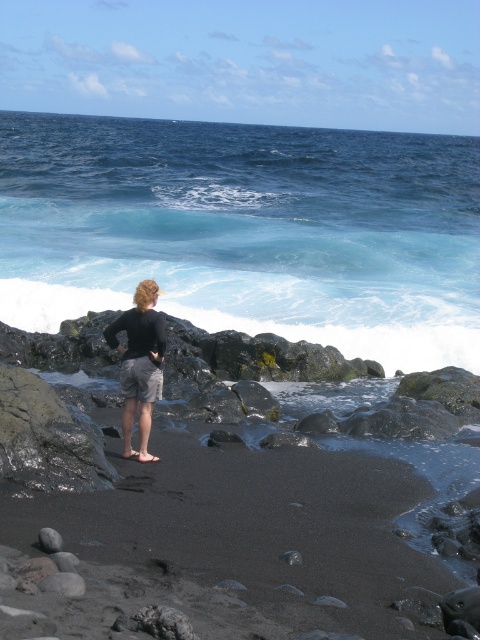
Based on the scene, can you determine if the blue liquid water at center reaches the height of the black matte shorts at center?

The blue liquid water at center is much taller than the black matte shorts at center, so yes, the water reaches higher than the shorts.

You are a photographer trying to capture the perfect shot of the blue liquid water at center and the black matte shorts at center. Based on their positions, can you determine if the water is splashing onto the shorts?

The blue liquid water at center is above black matte shorts at center, so yes, the water is splashing onto the black matte shorts at center.

You are a photographer planning to capture the scene of the blue liquid water at center and the black matte shorts at center. Based on their widths, which object should you focus on to ensure it fits entirely within your camera frame?

The blue liquid water at center has a greater width than the black matte shorts at center, so focusing on the black matte shorts at center would ensure it fits entirely within the camera frame.